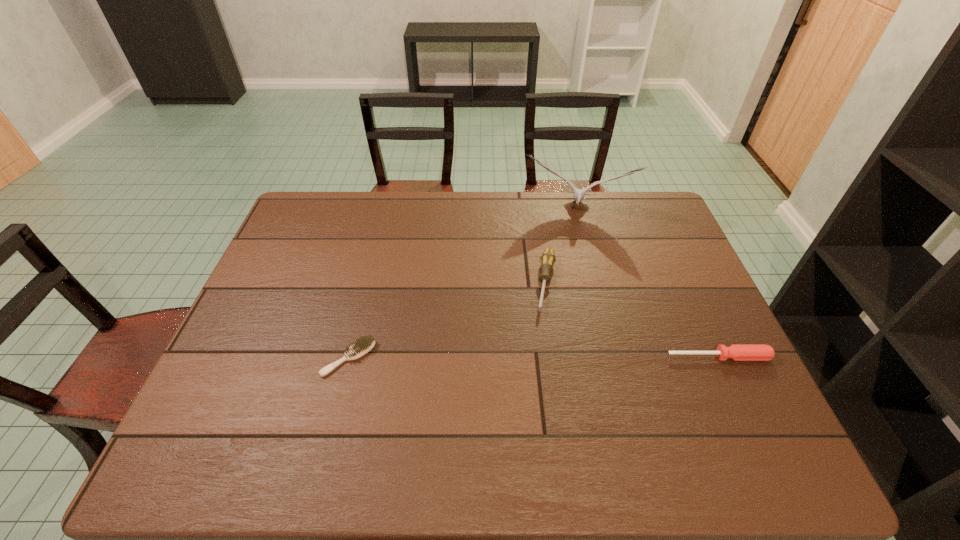
In the image, there is a desktop. Where is `vacant space at the far edge`? The height and width of the screenshot is (540, 960). vacant space at the far edge is located at coordinates (550, 203).

You are a GUI agent. You are given a task and a screenshot of the screen. Output one action in this format:
    pyautogui.click(x=<x>, y=<y>)
    Task: Click on the vacant area at the near edge
    This screenshot has width=960, height=540.
    Given the screenshot: What is the action you would take?
    pyautogui.click(x=353, y=413)

The image size is (960, 540). What are the coordinates of `free point at the left edge` in the screenshot? It's located at (252, 333).

In the image, there is a desktop. Where is `vacant space at the right edge`? vacant space at the right edge is located at coordinates (661, 292).

Where is `free region at the near left corner of the desktop`? free region at the near left corner of the desktop is located at coordinates (205, 410).

Find the location of a particular element. vacant space at the far right corner of the desktop is located at coordinates (645, 217).

Locate an element on the screen. free space between the second shortest object and the farthest object is located at coordinates (647, 284).

At what (x,y) coordinates should I click in order to perform the action: click on free space between the farthest object and the leftmost object. Please return your answer as a coordinate pair (x, y). Looking at the image, I should click on (462, 284).

Identify the location of vacant region between the right screwdriver and the shortest object. This screenshot has height=540, width=960. (534, 357).

This screenshot has height=540, width=960. What are the coordinates of `free space between the third tallest object and the gull` in the screenshot? It's located at (647, 284).